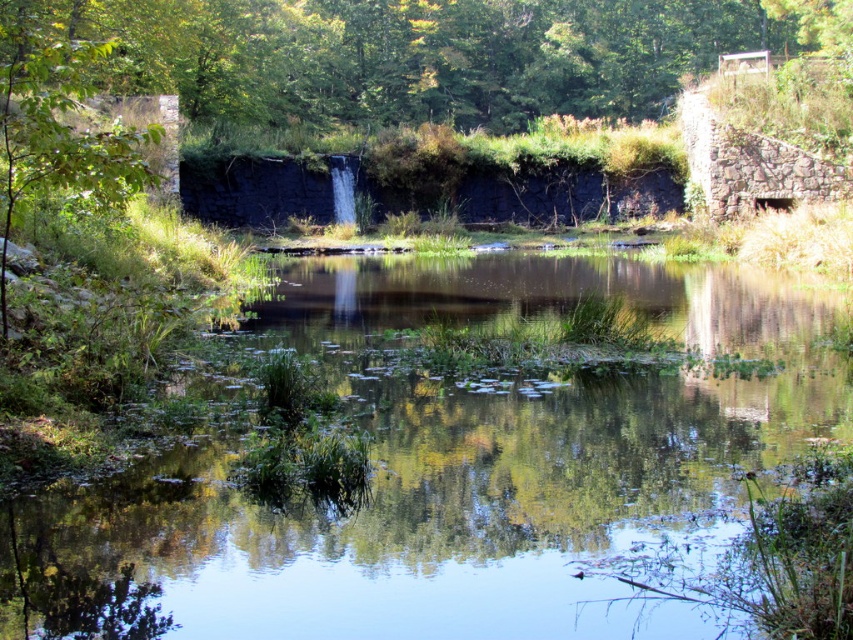
Does clear water at center appear on the right side of green leafy tree at upper left?

Correct, you'll find clear water at center to the right of green leafy tree at upper left.

Does point (82, 579) come closer to viewer compared to point (30, 104)?

Yes.

This screenshot has height=640, width=853. Identify the location of clear water at center. (450, 468).

Is point (492, 506) positioned after point (398, 51)?

No, it is not.

Is point (68, 595) closer to camera compared to point (596, 64)?

Yes, it is in front of point (596, 64).

Identify the location of clear water at center. [450, 468].

Locate an element on the screen. The width and height of the screenshot is (853, 640). clear water at center is located at coordinates (450, 468).

Between point (509, 99) and point (115, 134), which one is positioned behind?

The point (509, 99) is more distant.

Is point (325, 68) more distant than point (6, 332)?

That is True.

Where is `green leafy tree at upper center`? green leafy tree at upper center is located at coordinates (421, 52).